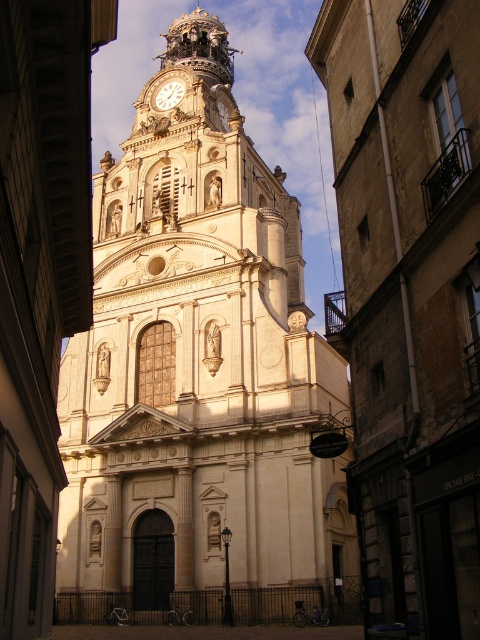
Question: Does white stone church at center have a lesser width compared to gold metallic clock at upper center?

Choices:
 (A) yes
 (B) no

Answer: (B)

Question: Is white stone church at center behind gold metallic clock at upper center?

Choices:
 (A) yes
 (B) no

Answer: (B)

Question: Which object is the farthest from the white stone church at center?

Choices:
 (A) white stone tower at center
 (B) gold metallic clock at upper center

Answer: (B)

Question: Can you confirm if white stone church at center is bigger than gold metallic clock at upper center?

Choices:
 (A) yes
 (B) no

Answer: (A)

Question: Which object is closer to the camera taking this photo?

Choices:
 (A) white stone tower at center
 (B) gold metallic clock at upper center
 (C) white stone church at center

Answer: (C)

Question: Which of the following is the closest to the observer?

Choices:
 (A) white stone church at center
 (B) gold metallic clock at upper center
 (C) white stone tower at center

Answer: (A)